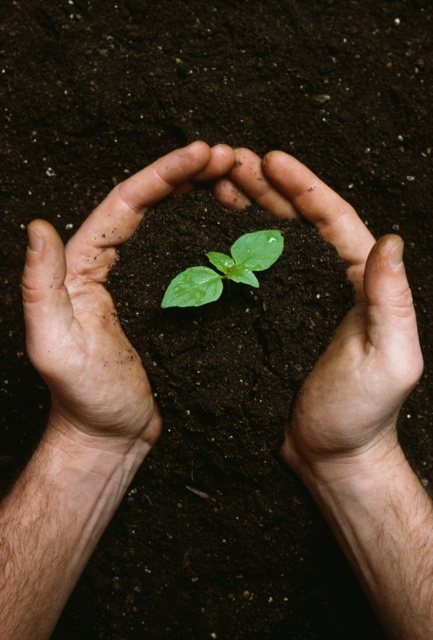
Who is more forward, (55, 394) or (217, 276)?

Point (55, 394) is in front.

This screenshot has width=433, height=640. Identify the location of smooth skin hands at center. (138, 356).

Between point (323, 236) and point (242, 248), which one is positioned in front?

Point (242, 248)

At what (x,y) coordinates should I click in order to perform the action: click on smooth skin hands at center. Please return your answer as a coordinate pair (x, y). This screenshot has height=640, width=433. Looking at the image, I should click on (138, 356).